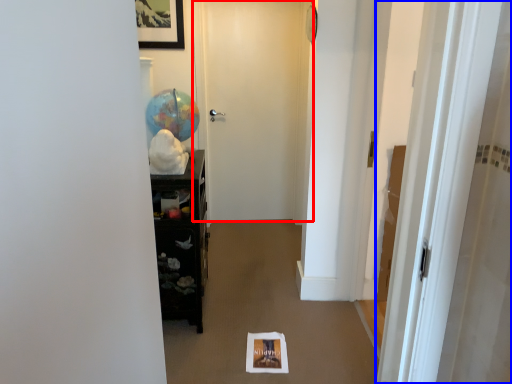
Question: Which object appears closest to the camera in this image, door (highlighted by a red box) or door (highlighted by a blue box)?

Choices:
 (A) door
 (B) door

Answer: (B)